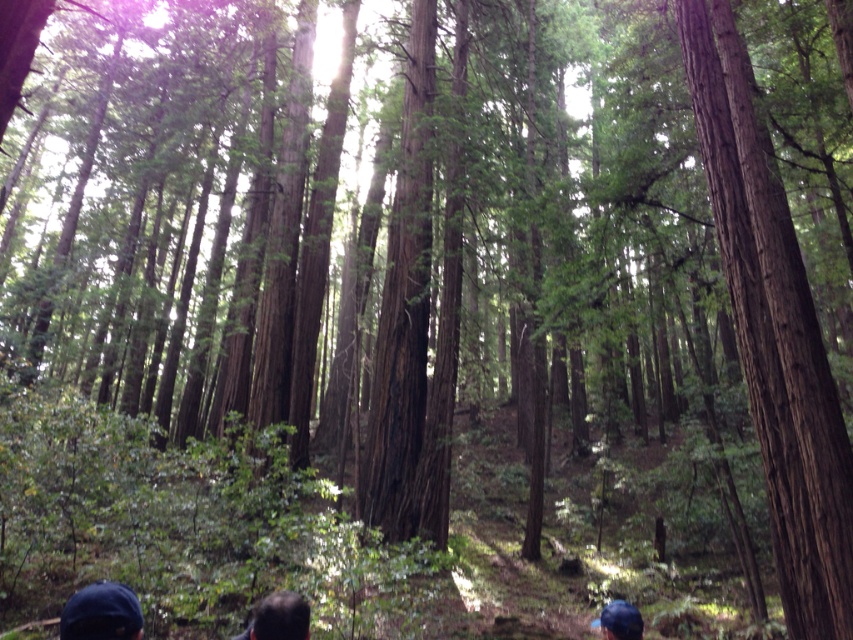
Is point (119, 616) positioned after point (292, 624)?

No, it is not.

Does dark blue fabric cap at lower left appear on the left side of dark brown hair at lower center?

Correct, you'll find dark blue fabric cap at lower left to the left of dark brown hair at lower center.

Image resolution: width=853 pixels, height=640 pixels. What do you see at coordinates (102, 612) in the screenshot?
I see `dark blue fabric cap at lower left` at bounding box center [102, 612].

Locate an element on the screen. dark blue fabric cap at lower left is located at coordinates (102, 612).

Is smooth brown tree trunk at center behind dark brown hair at lower center?

Yes, it is.

Between smooth brown tree trunk at center and dark brown hair at lower center, which one appears on the right side from the viewer's perspective?

From the viewer's perspective, smooth brown tree trunk at center appears more on the right side.

Which is behind, point (825, 572) or point (265, 612)?

Point (825, 572)

You are a GUI agent. You are given a task and a screenshot of the screen. Output one action in this format:
    pyautogui.click(x=<x>, y=<y>)
    Task: Click on the smooth brown tree trunk at center
    
    Given the screenshot: What is the action you would take?
    pyautogui.click(x=773, y=336)

Identify the location of dark brown hair at lower center. The width and height of the screenshot is (853, 640). (277, 618).

Is dark brown hair at lower center to the left of blue fabric cap at lower center from the viewer's perspective?

Yes, dark brown hair at lower center is to the left of blue fabric cap at lower center.

Where is `dark brown hair at lower center`? This screenshot has width=853, height=640. dark brown hair at lower center is located at coordinates (277, 618).